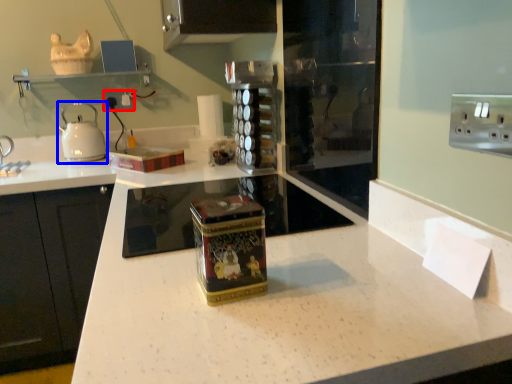
Question: Which point is further to the camera, electric outlet (highlighted by a red box) or kitchen appliance (highlighted by a blue box)?

Choices:
 (A) electric outlet
 (B) kitchen appliance

Answer: (A)